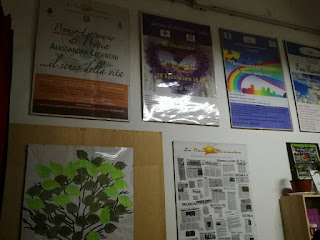
Locate an element on the screen. The image size is (320, 240). gray wall is located at coordinates (260, 143).